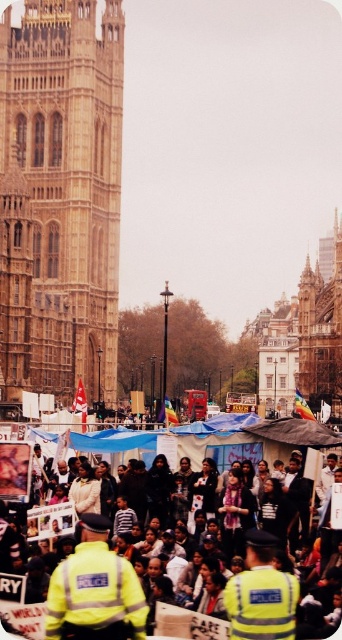
Question: Which point appears farthest from the camera in this image?

Choices:
 (A) (12, 612)
 (B) (59, 304)
 (C) (76, 577)

Answer: (B)

Question: Which point is closer to the camera?

Choices:
 (A) yellow reflective vests at center
 (B) reflective yellow jacket at lower left

Answer: (B)

Question: Can you confirm if reflective yellow jacket at lower left is positioned above yellow reflective vests at center?

Choices:
 (A) yes
 (B) no

Answer: (A)

Question: Which object is positioned farthest from the yellow reflective vests at center?

Choices:
 (A) golden stone tower at center
 (B) reflective yellow jacket at lower left

Answer: (A)

Question: Does golden stone tower at center have a greater width compared to reflective yellow jacket at lower left?

Choices:
 (A) no
 (B) yes

Answer: (B)

Question: Does golden stone tower at center have a smaller size compared to reflective yellow jacket at lower left?

Choices:
 (A) no
 (B) yes

Answer: (A)